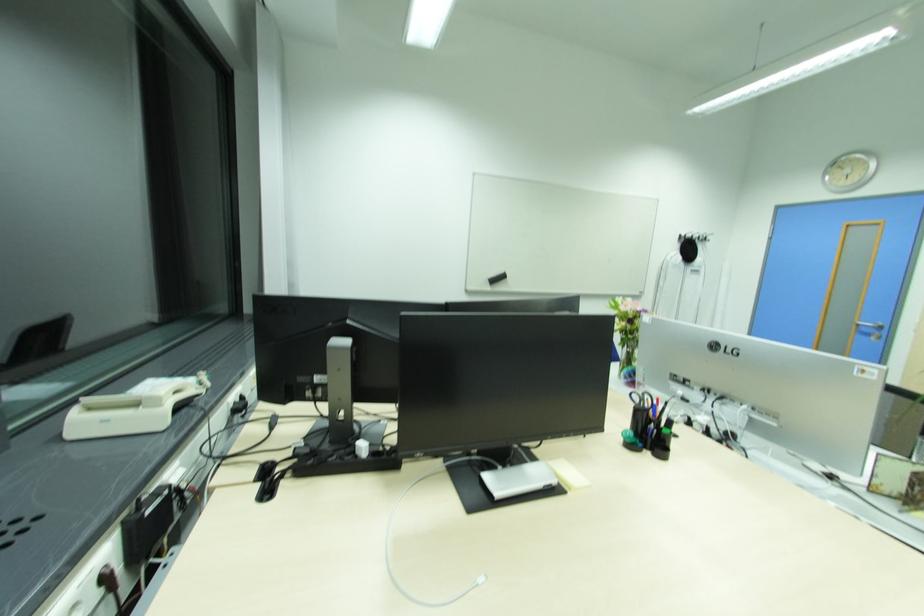
Find the location of a particular element. silver door handle is located at coordinates (847, 286).